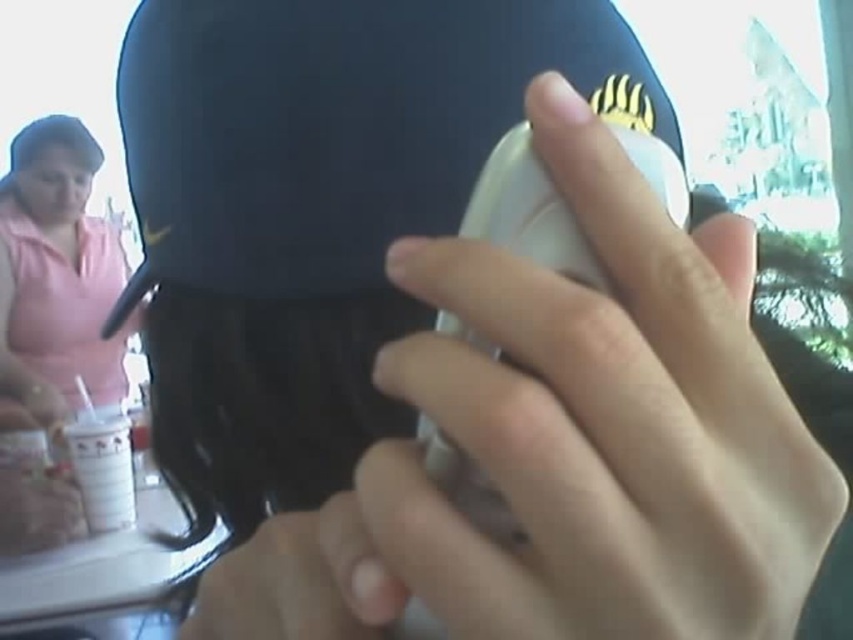
Can you confirm if matte black baseball cap at center is smaller than white paper cup at lower left?

Yes.

Consider the image. Can you confirm if matte black baseball cap at center is positioned to the left of white paper cup at lower left?

In fact, matte black baseball cap at center is to the right of white paper cup at lower left.

What do you see at coordinates (338, 125) in the screenshot? This screenshot has height=640, width=853. I see `matte black baseball cap at center` at bounding box center [338, 125].

Where is `matte black baseball cap at center`? matte black baseball cap at center is located at coordinates (338, 125).

Which of these two, white matte phone at center or pink cotton shirt at upper left, stands taller?

With more height is pink cotton shirt at upper left.

Who is positioned more to the right, white matte phone at center or pink cotton shirt at upper left?

Positioned to the right is white matte phone at center.

The width and height of the screenshot is (853, 640). In order to click on white matte phone at center in this screenshot , I will do `click(566, 444)`.

Locate an element on the screen. Image resolution: width=853 pixels, height=640 pixels. white matte phone at center is located at coordinates (566, 444).

Between white matte phone at center and white paper cup at lower left, which one is positioned lower?

white paper cup at lower left is lower down.

Who is more forward, (720,509) or (111,426)?

Point (720,509) is more forward.

Is point (585, 464) positioned after point (102, 436)?

No, it is in front of (102, 436).

Locate an element on the screen. Image resolution: width=853 pixels, height=640 pixels. white matte phone at center is located at coordinates (566, 444).